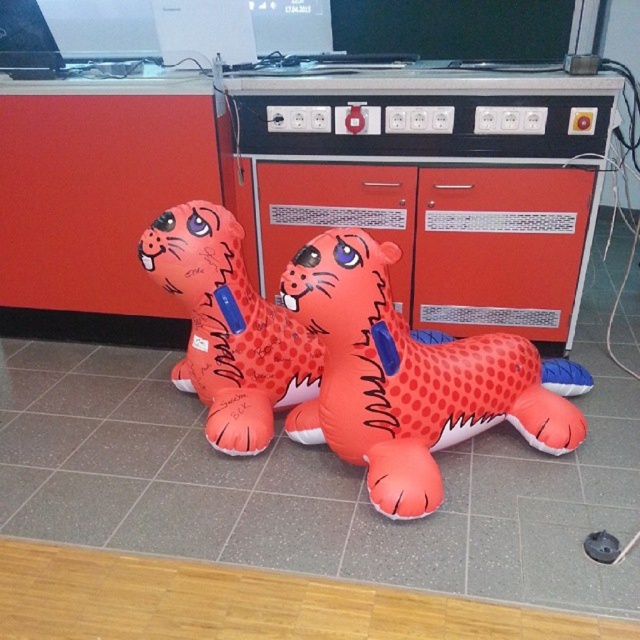
Question: Is rubber/inflatable tiger at center thinner than rubber orange tiger at center?

Choices:
 (A) no
 (B) yes

Answer: (A)

Question: Which point appears closest to the camera in this image?

Choices:
 (A) (352, 426)
 (B) (292, 324)
 (C) (566, 246)

Answer: (A)

Question: Which is farther from the rubber/inflatable tiger at center?

Choices:
 (A) rubber inflatable tiger at center
 (B) rubber orange tiger at center

Answer: (A)

Question: Is the position of rubber inflatable tiger at center less distant than that of rubber orange tiger at center?

Choices:
 (A) yes
 (B) no

Answer: (B)

Question: Does rubber/inflatable tiger at center have a larger size compared to rubber orange tiger at center?

Choices:
 (A) no
 (B) yes

Answer: (B)

Question: Which point is closer to the camera?

Choices:
 (A) rubber orange tiger at center
 (B) rubber/inflatable tiger at center
 (C) rubber inflatable tiger at center

Answer: (B)